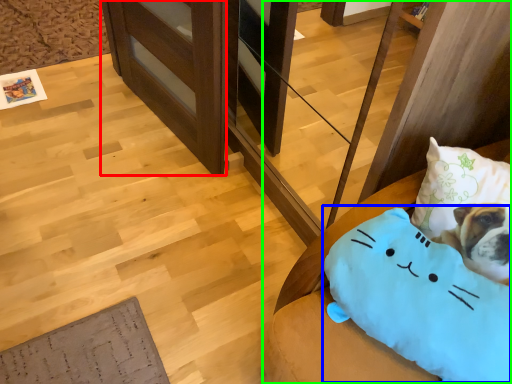
Question: Which object is the farthest from shelf (highlighted by a red box)? Choose among these: pillow (highlighted by a blue box) or furniture (highlighted by a green box).

Choices:
 (A) pillow
 (B) furniture

Answer: (A)